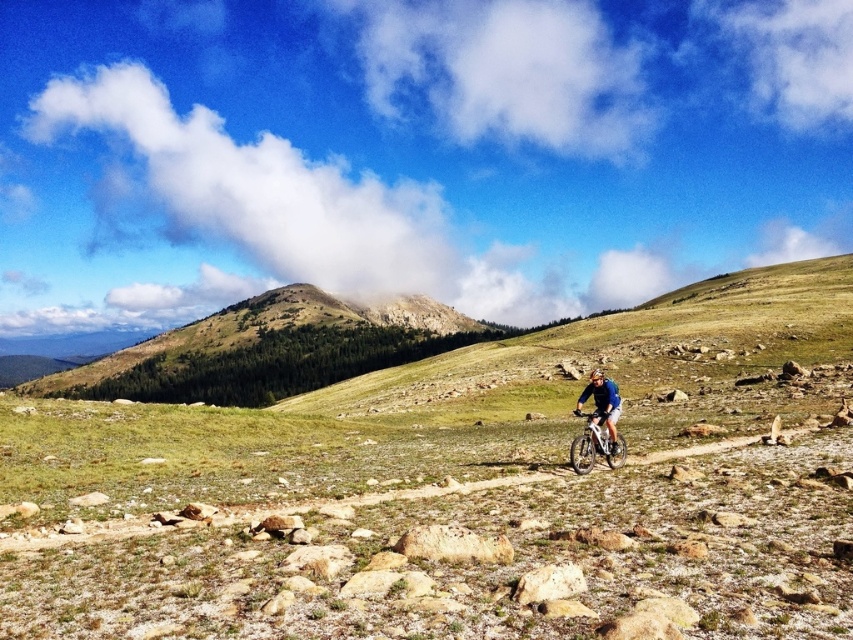
You are navigating a drone to capture aerial footage of the scenic outdoor setting. The drone must avoid the green forested mountain at upper center. Based on its coordinates, can you determine if the drone can safely fly directly above the midground path without obstruction?

The green forested mountain at upper center is located at point (270, 349), so the drone can safely fly directly above the midground path since the mountain is positioned away from the path and its coordinates do not overlap with the path area.

You are a hiker planning to take a photo of the green forested mountain at upper center and the blue matte shirt at center. Which object should you focus on first to ensure both are in frame?

The green forested mountain at upper center is above the blue matte shirt at center, so you should focus on the blue matte shirt at center first to ensure both are in frame.

You are a hiker planning to take a photo of the green forested mountain at upper center and the blue matte shirt at center. Based on their positions, which object should appear closer to the camera in your photo?

The blue matte shirt at center is behind the green forested mountain at upper center, so the green forested mountain at upper center will appear closer to the camera in the photo.